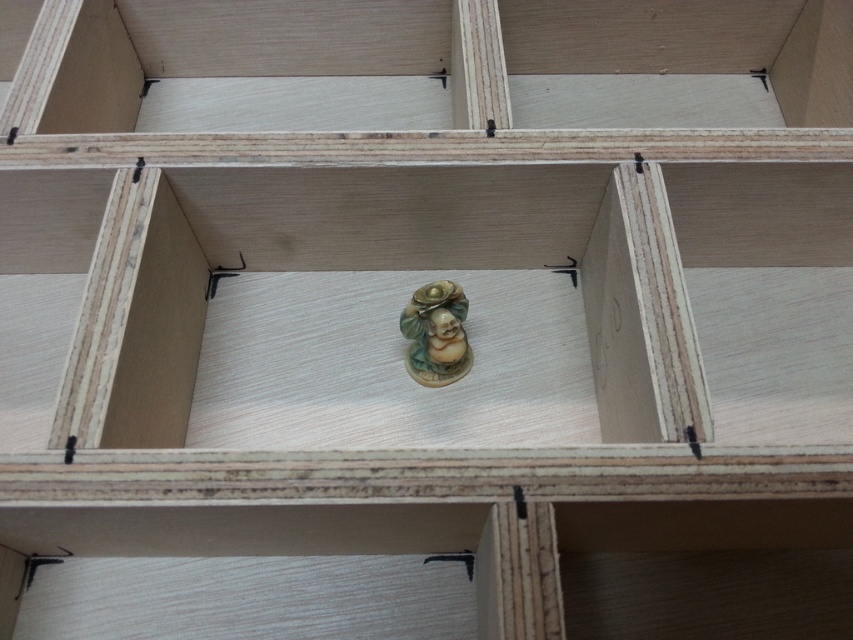
You are organizing a display in the wooden shelving unit and notice the matte ceramic statue at center and the matte ceramic figurine at center. Which object is placed higher on the shelf?

The matte ceramic statue at center is positioned over the matte ceramic figurine at center, so the statue is higher.